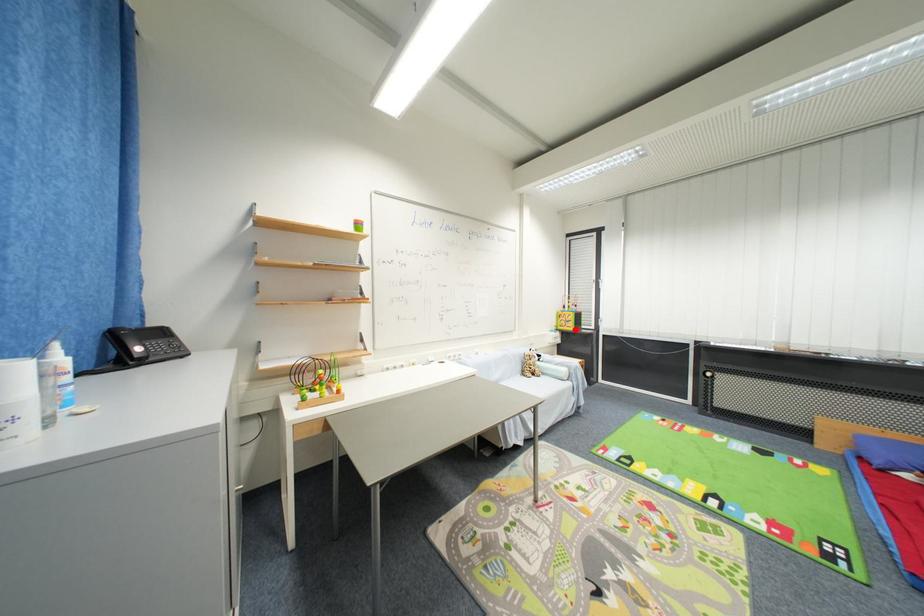
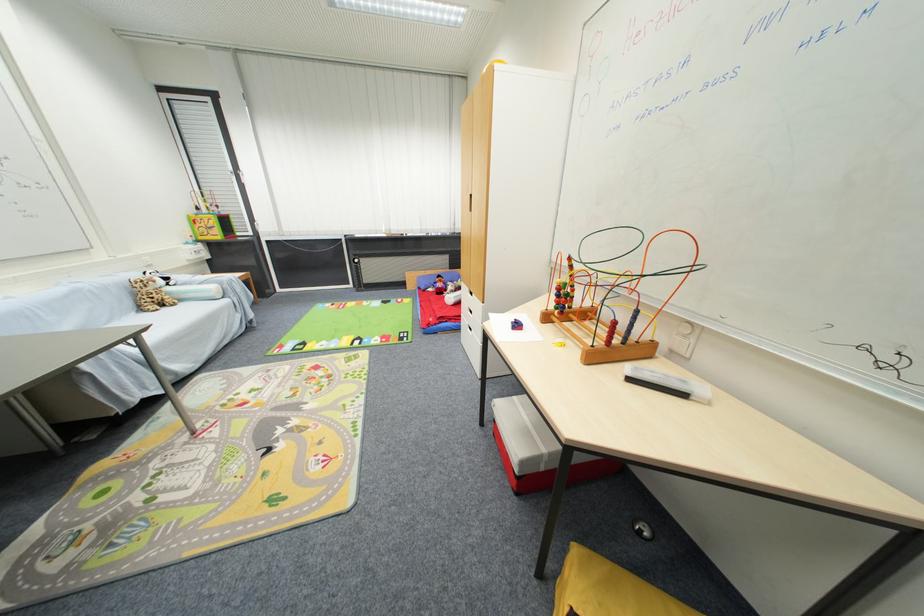
Question: I am providing you with two images of the same scene from different viewpoints. A red point is marked on the first image. Is the red point's position out of view in image 2?

Choices:
 (A) Yes
 (B) No

Answer: (B)